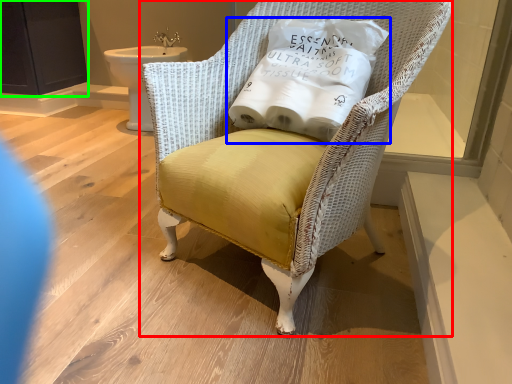
Question: Based on their relative distances, which object is nearer to chair (highlighted by a red box)? Choose from pillow (highlighted by a blue box) and screen door (highlighted by a green box).

Choices:
 (A) pillow
 (B) screen door

Answer: (A)